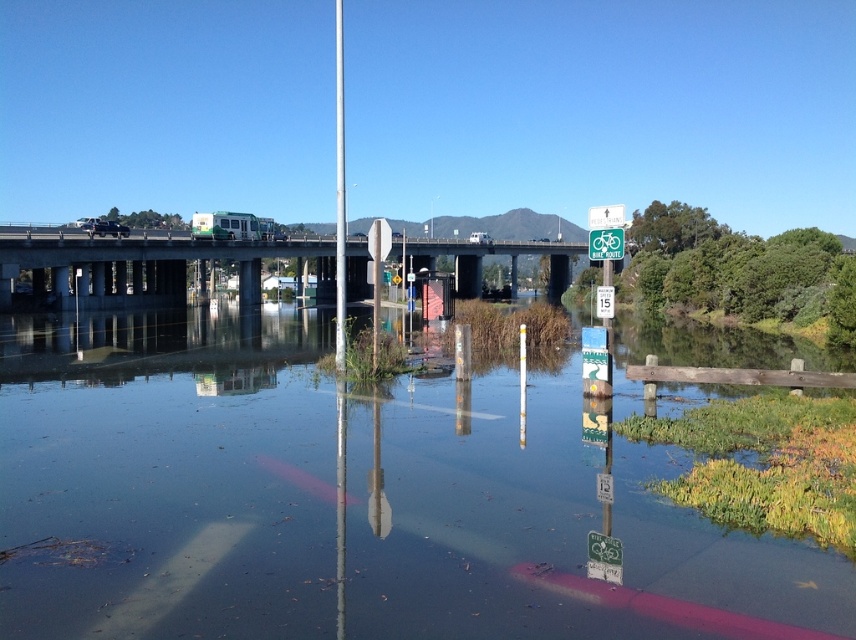
Question: Considering the relative positions of clear water at lower center and concrete bridge at upper center in the image provided, where is clear water at lower center located with respect to concrete bridge at upper center?

Choices:
 (A) right
 (B) left

Answer: (A)

Question: Estimate the real-world distances between objects in this image. Which object is farther from the green plastic bike route sign at center?

Choices:
 (A) clear water at lower center
 (B) metallic pole at center

Answer: (B)

Question: Does concrete bridge at upper center have a lesser width compared to green plastic bike route sign at center?

Choices:
 (A) yes
 (B) no

Answer: (B)

Question: Which object is farther from the camera taking this photo?

Choices:
 (A) clear water at lower center
 (B) metallic pole at center
 (C) concrete bridge at upper center
 (D) green plastic bike route sign at center

Answer: (C)

Question: Is clear water at lower center smaller than green plastic bike route sign at center?

Choices:
 (A) yes
 (B) no

Answer: (B)

Question: Which of these objects is positioned closest to the metallic pole at center?

Choices:
 (A) green plastic bike route sign at center
 (B) concrete bridge at upper center

Answer: (A)